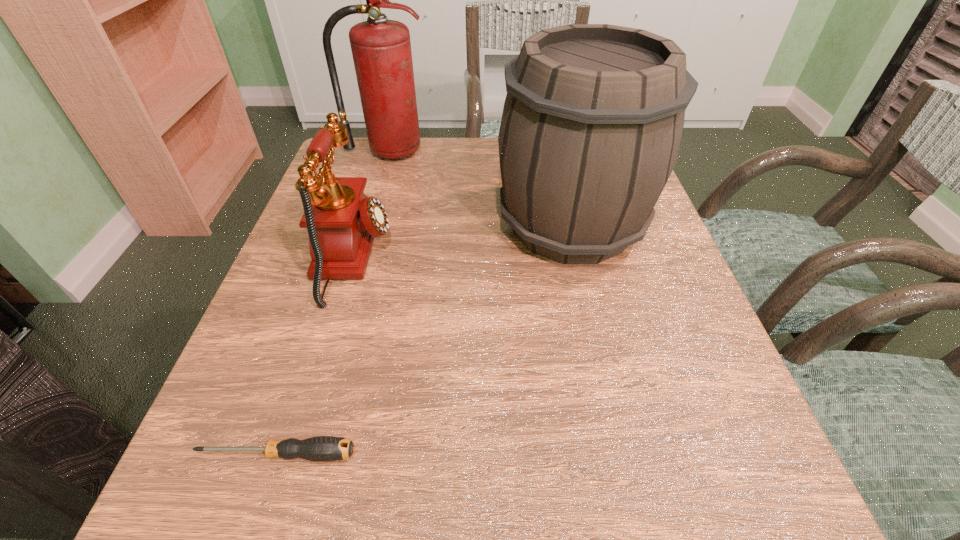
Find the location of `vacant region at the near edge of the desktop`. vacant region at the near edge of the desktop is located at coordinates (362, 497).

The height and width of the screenshot is (540, 960). In the image, there is a desktop. Find the location of `vacant space at the left edge`. vacant space at the left edge is located at coordinates (276, 346).

The image size is (960, 540). Find the location of `free region at the right edge of the desktop`. free region at the right edge of the desktop is located at coordinates (617, 264).

Where is `vacant space at the near left corner`? vacant space at the near left corner is located at coordinates (233, 519).

Image resolution: width=960 pixels, height=540 pixels. What are the coordinates of `free space between the wine bucket and the shortest object` in the screenshot? It's located at (424, 340).

Find the location of a particular element. free space that is in between the farthest object and the wine bucket is located at coordinates (479, 188).

Where is `free spot between the farthest object and the nearest object`? free spot between the farthest object and the nearest object is located at coordinates (332, 303).

Image resolution: width=960 pixels, height=540 pixels. I want to click on vacant space that's between the farthest object and the screwdriver, so click(332, 303).

The width and height of the screenshot is (960, 540). In order to click on empty space between the farthest object and the rightmost object in this screenshot , I will do `click(479, 188)`.

I want to click on vacant space in between the second shortest object and the screwdriver, so [316, 356].